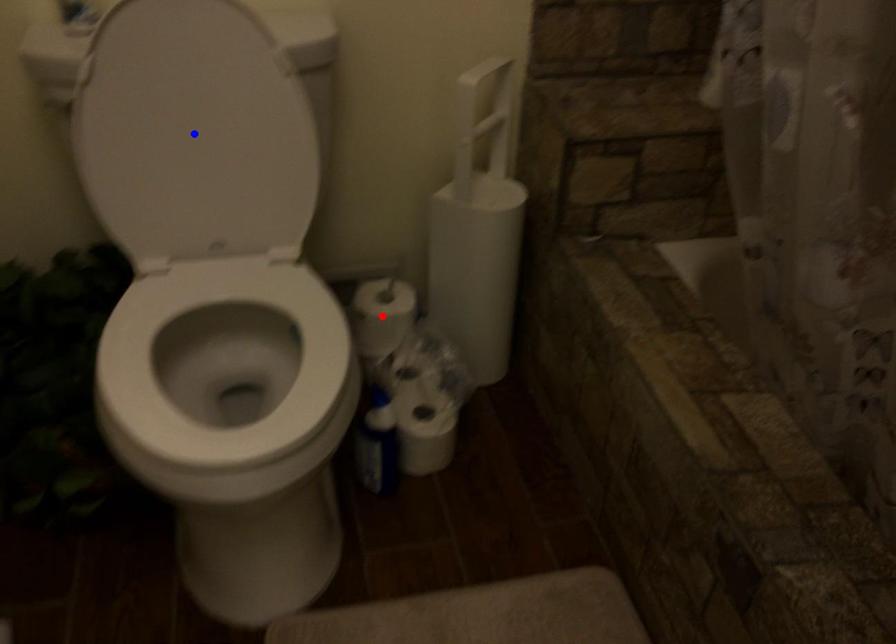
Question: Two points are marked on the image. Which point is closer to the camera?

Choices:
 (A) Blue point is closer.
 (B) Red point is closer.

Answer: (A)